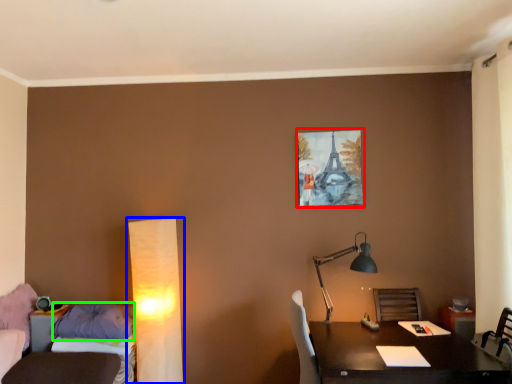
Question: Which object is the farthest from picture frame (highlighted by a red box)? Choose among these: lamp (highlighted by a blue box) or pillow (highlighted by a green box).

Choices:
 (A) lamp
 (B) pillow

Answer: (B)